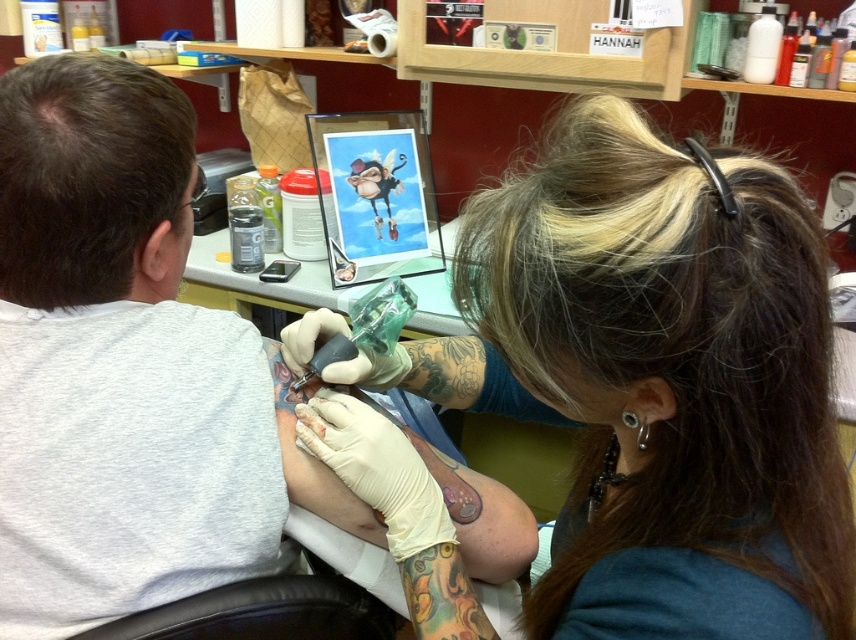
Question: In this image, where is smooth skin at upper right located relative to white latex gloves at upper center?

Choices:
 (A) below
 (B) above

Answer: (B)

Question: Which point is farther to the camera?

Choices:
 (A) white latex gloves at upper center
 (B) smooth skin at upper right

Answer: (A)

Question: In this image, where is smooth skin at upper right located relative to white latex gloves at upper center?

Choices:
 (A) left
 (B) right

Answer: (B)

Question: Does smooth skin at upper right appear over white latex gloves at upper center?

Choices:
 (A) yes
 (B) no

Answer: (A)